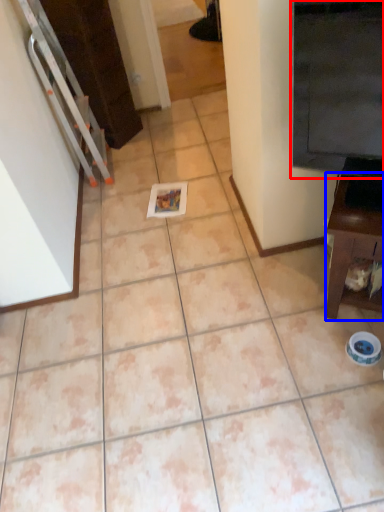
Question: Which object appears closest to the camera in this image, fridge (highlighted by a red box) or furniture (highlighted by a blue box)?

Choices:
 (A) fridge
 (B) furniture

Answer: (A)